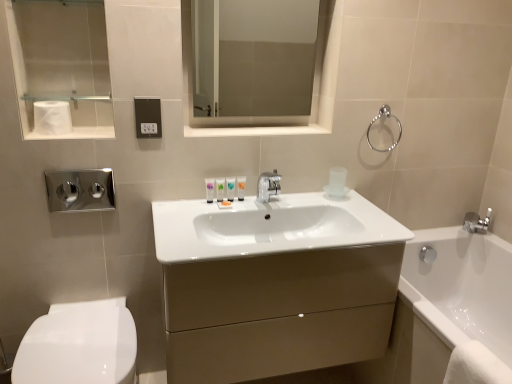
Question: From a real-world perspective, is white glossy tube at center, acting as the 3th toiletry starting from the right, positioned above or below white matte toilet paper at upper left?

Choices:
 (A) below
 (B) above

Answer: (A)

Question: Do you think white glossy tube at center, positioned as the second toiletry in left-to-right order, is within white matte toilet paper at upper left, or outside of it?

Choices:
 (A) outside
 (B) inside

Answer: (A)

Question: Which object is the farthest from the white glossy tube at center, acting as the 3th toiletry starting from the right?

Choices:
 (A) black plastic outlet at center
 (B) translucent plastic tube at center, the third toiletry in the left-to-right sequence
 (C) white glossy tube at center, which is the 1th toiletry from right to left
 (D) white glossy toilet at lower left
 (E) brushed metal towel bar at upper left

Answer: (D)

Question: Which object is positioned closest to the translucent plastic tube at center, the third toiletry in the left-to-right sequence?

Choices:
 (A) matte beige cabinet at center
 (B) white glossy toilet at lower left
 (C) matte purple tube at center, the fourth toiletry from the right
 (D) white glossy tube at center, which is the 4th toiletry in left-to-right order
 (E) black plastic outlet at center

Answer: (D)